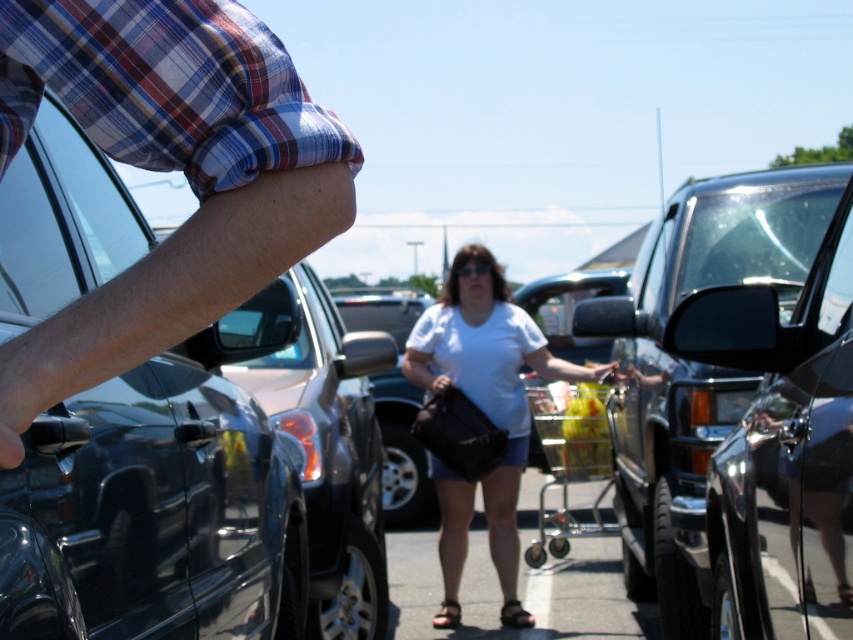
Consider the image. Which is more to the left, plaid fabric sleeve at upper left or white matte shirt at center?

plaid fabric sleeve at upper left is more to the left.

Does plaid fabric sleeve at upper left appear over white matte shirt at center?

Correct, plaid fabric sleeve at upper left is located above white matte shirt at center.

Between point (47, 54) and point (486, 488), which one is positioned in front?

Point (47, 54) is more forward.

The height and width of the screenshot is (640, 853). Identify the location of plaid fabric sleeve at upper left. (167, 170).

Who is taller, plaid fabric sleeve at upper left or glossy black car at center?

glossy black car at center is taller.

Is plaid fabric sleeve at upper left smaller than glossy black car at center?

Indeed, plaid fabric sleeve at upper left has a smaller size compared to glossy black car at center.

Locate an element on the screen. plaid fabric sleeve at upper left is located at coordinates (167, 170).

Is point (851, 205) closer to camera compared to point (492, 333)?

Yes, it is in front of point (492, 333).

Where is `glossy black car at center`? The height and width of the screenshot is (640, 853). glossy black car at center is located at coordinates (781, 449).

The image size is (853, 640). I want to click on glossy black car at center, so click(781, 449).